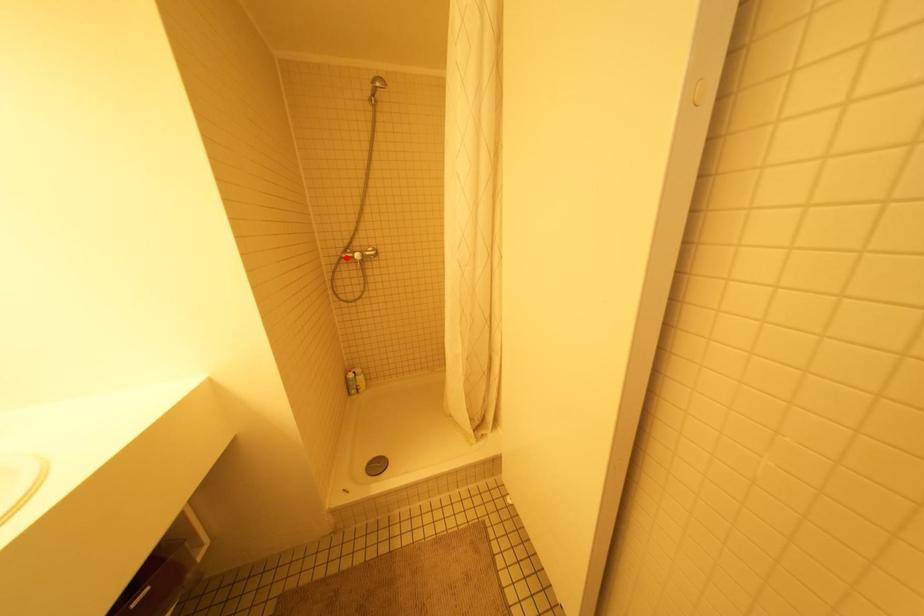
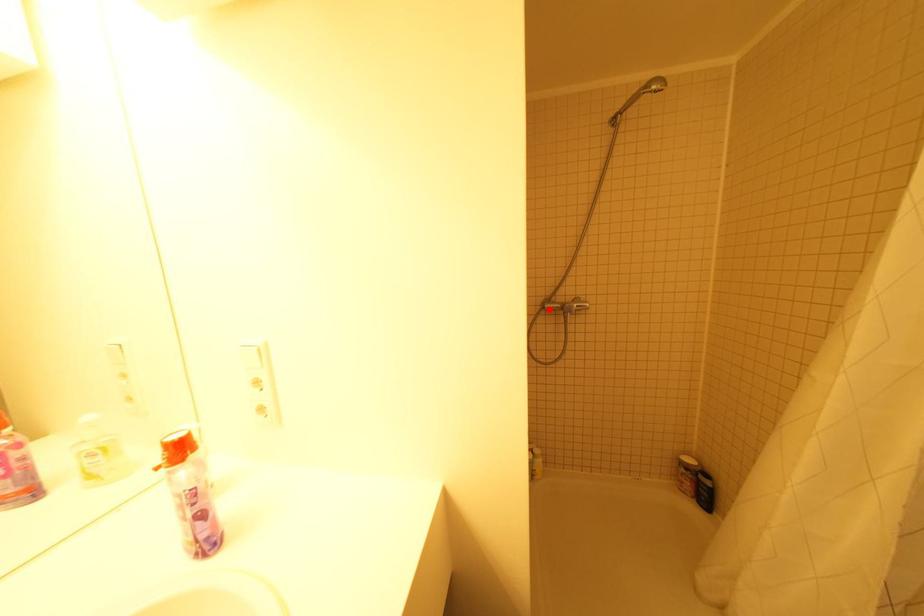
I am providing you with two images of the same scene from different viewpoints. A red point is marked on the first image and another point is marked on the second image. Is the red point in image1 aligned with the point shown in image2?

Yes